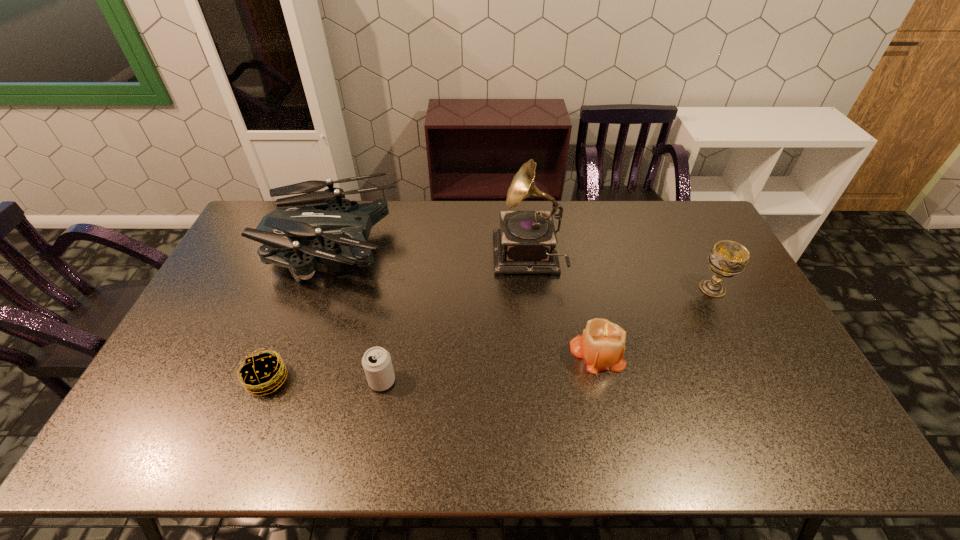
Find the location of a particular element. The image size is (960, 540). vacant point located on the back of the chalice is located at coordinates (685, 236).

This screenshot has height=540, width=960. What are the coordinates of `free region located on the back of the candle` in the screenshot? It's located at (580, 276).

Where is `vacant area situated 0.150m on the back of the second shortest object`? The image size is (960, 540). vacant area situated 0.150m on the back of the second shortest object is located at coordinates (392, 326).

I want to click on free spot located 0.070m on the left of the shortest object, so click(219, 380).

Identify the location of record player present at the far edge. (526, 242).

The height and width of the screenshot is (540, 960). Find the location of `drone that is positioned at the far edge`. drone that is positioned at the far edge is located at coordinates (340, 220).

The image size is (960, 540). In order to click on object present at the left edge in this screenshot , I will do `click(340, 220)`.

Image resolution: width=960 pixels, height=540 pixels. I want to click on object at the right edge, so click(x=727, y=258).

The height and width of the screenshot is (540, 960). Identify the location of object located at the far left corner. (340, 220).

Where is `free space at the near edge of the desktop`? Image resolution: width=960 pixels, height=540 pixels. free space at the near edge of the desktop is located at coordinates (637, 429).